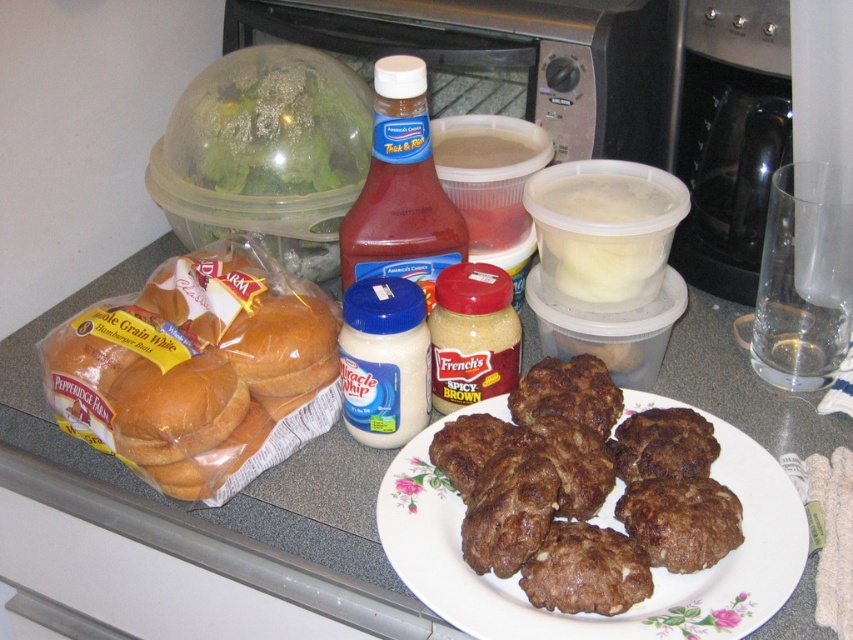
Consider the image. Can you confirm if brown matte/hard bread at left is thinner than red glass bottle at center?

No.

Which is more to the right, brown matte/hard bread at left or red glass bottle at center?

red glass bottle at center

Between point (100, 358) and point (427, 243), which one is positioned behind?

Positioned behind is point (427, 243).

Identify the location of brown matte/hard bread at left. (199, 371).

Is point (146, 392) positioned after point (706, 552)?

Yes, it is.

What do you see at coordinates (199, 371) in the screenshot?
I see `brown matte/hard bread at left` at bounding box center [199, 371].

You are a GUI agent. You are given a task and a screenshot of the screen. Output one action in this format:
    pyautogui.click(x=<x>, y=<y>)
    Task: Click on the brown matte/hard bread at left
    This screenshot has width=853, height=640.
    Given the screenshot: What is the action you would take?
    pyautogui.click(x=199, y=371)

Between brown crispy patty at center and red glass bottle at center, which one has less height?

brown crispy patty at center

Is brown crispy patty at center positioned at the back of red glass bottle at center?

No, brown crispy patty at center is in front of red glass bottle at center.

Image resolution: width=853 pixels, height=640 pixels. In order to click on brown crispy patty at center in this screenshot , I will do `click(585, 490)`.